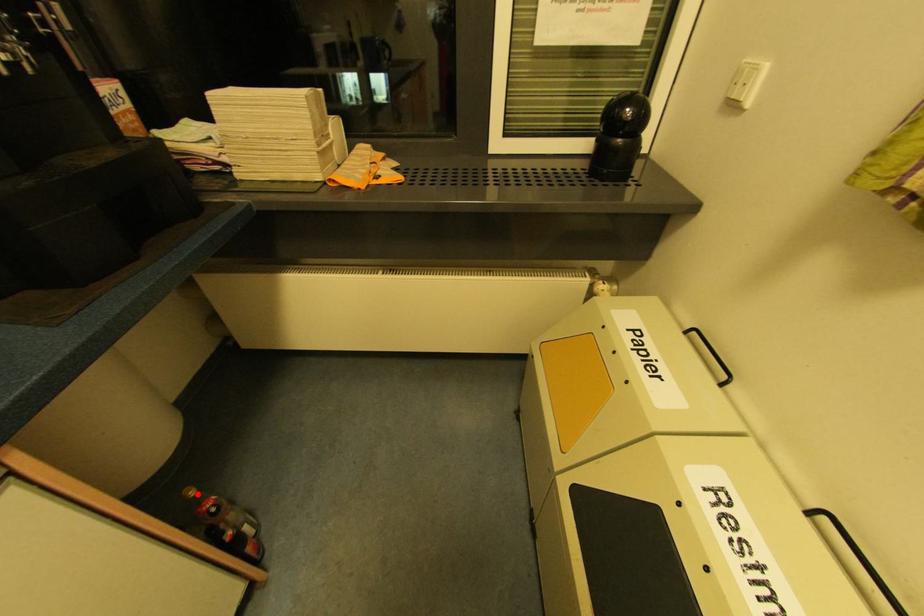
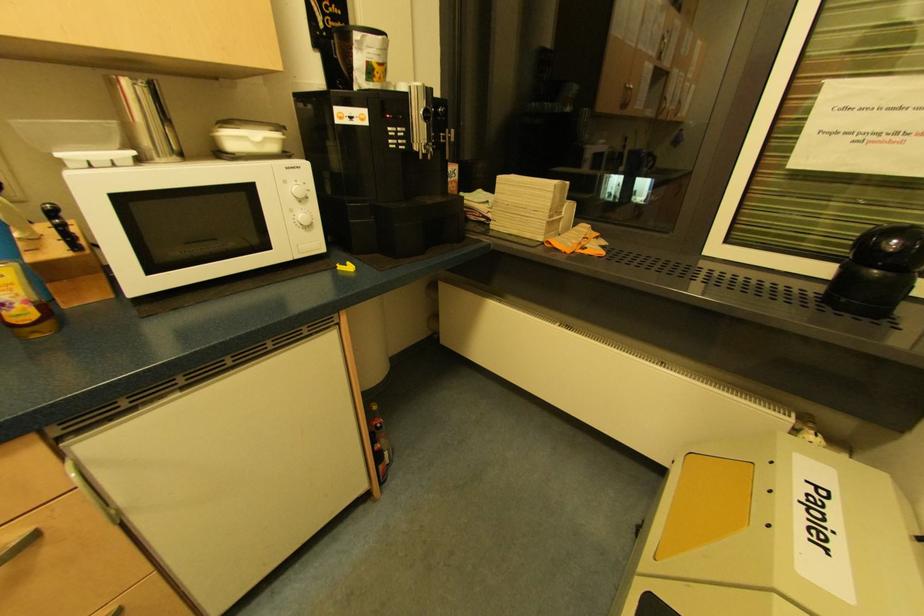
Locate, in the second image, the point that corresponds to the highlighted location in the first image.

(378, 410)